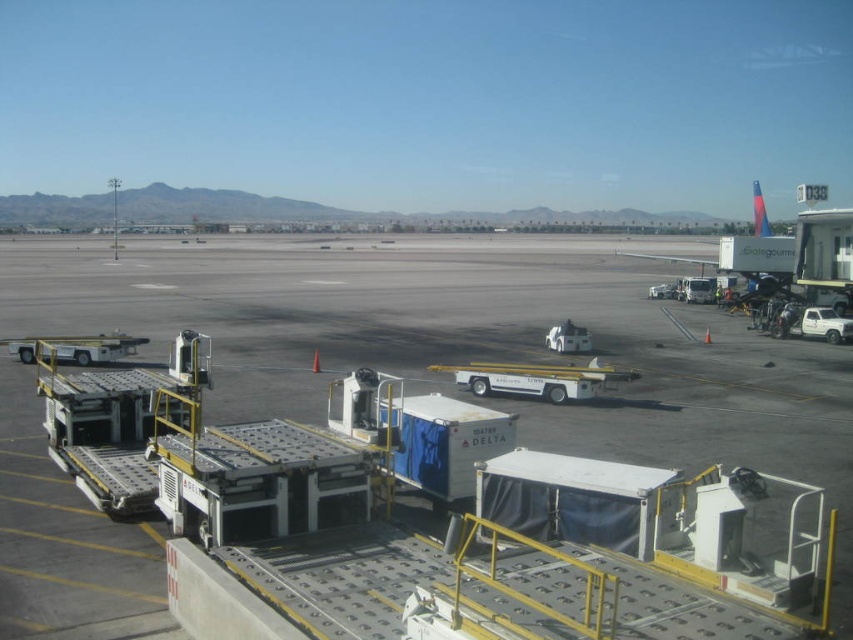
Question: Which point appears farthest from the camera in this image?

Choices:
 (A) (787, 349)
 (B) (628, 253)

Answer: (B)

Question: Observing the image, what is the correct spatial positioning of metallic gray tarmac at center in reference to matte blue airplane at right?

Choices:
 (A) left
 (B) right

Answer: (A)

Question: Does metallic gray tarmac at center appear on the left side of matte blue airplane at right?

Choices:
 (A) no
 (B) yes

Answer: (B)

Question: Which object is closer to the camera taking this photo?

Choices:
 (A) metallic gray tarmac at center
 (B) matte blue airplane at right

Answer: (A)

Question: Does metallic gray tarmac at center lie in front of matte blue airplane at right?

Choices:
 (A) no
 (B) yes

Answer: (B)